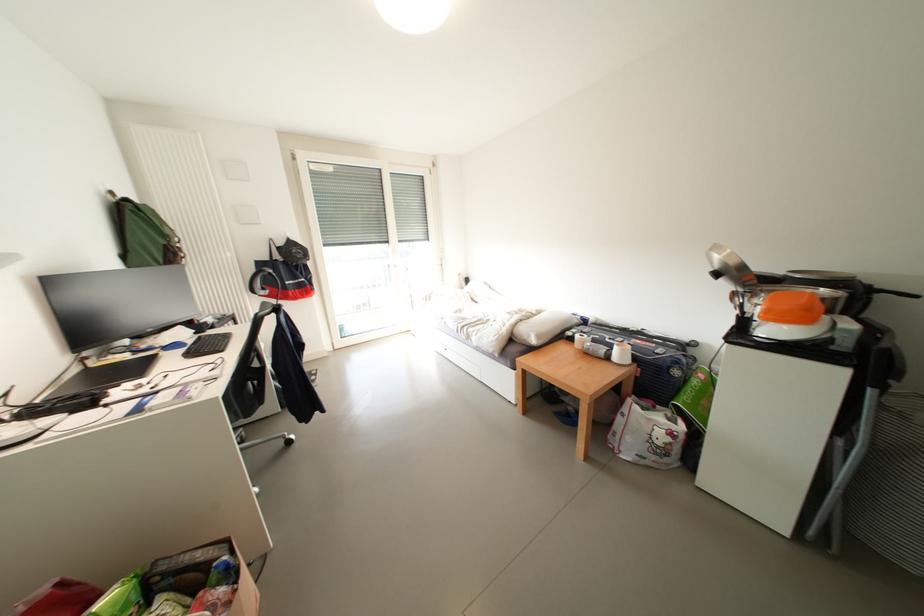
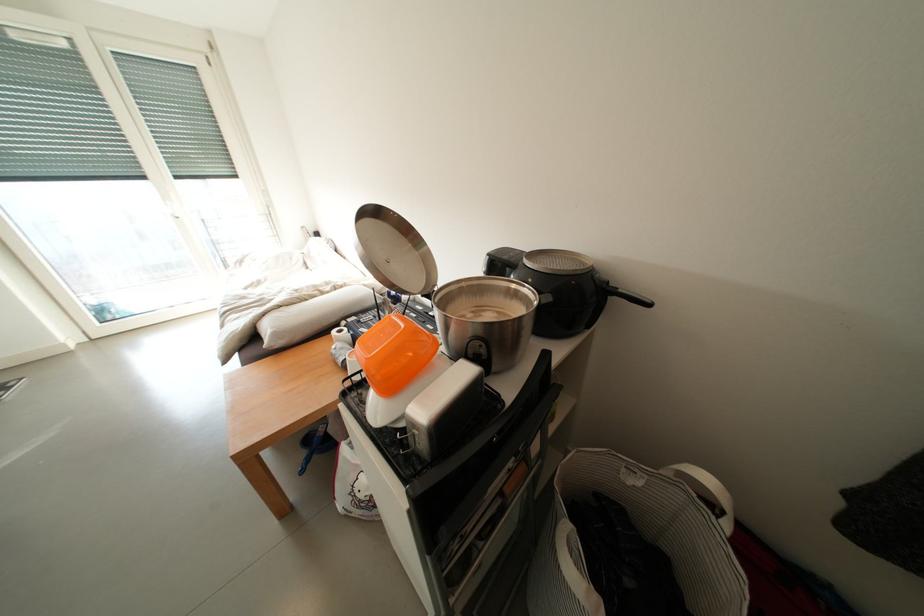
Consider the image. Which direction would the cameraman need to move to produce the second image?

The movement direction of the cameraman is right, forward.